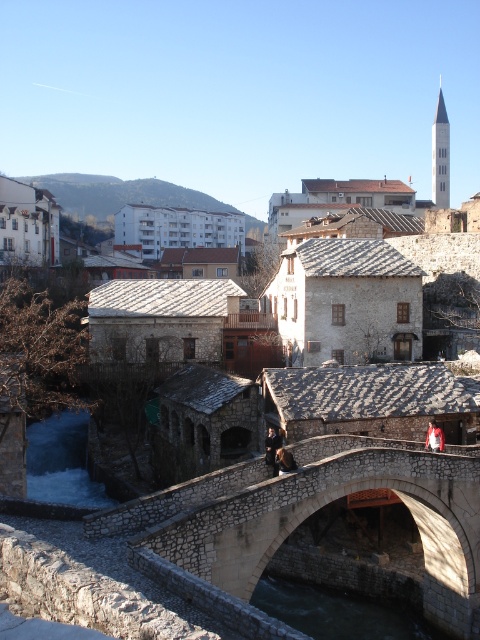
You are a tourist standing on the historic stone bridge and want to take a photo of the river below. Which part of the river, the green stone water at lower center or the white frothy water at lower left, would have a narrower width for capturing in your shot?

The green stone water at lower center has a narrower width compared to the white frothy water at lower left, so it would be better to capture the green stone water at lower center in your photo for a narrower view.

You are standing on the historic stone bridge and want to find the green stone water at lower center. Based on the coordinates provided in the Objects Description, in which direction should you look relative to your position on the bridge?

The green stone water at lower center is located at coordinates point (x=340, y=611). Since the coordinate system typically places the origin at the bottom left corner, the x value of 0.956 indicates a position far to the right, and the y value of 0.710 suggests it is near the bottom of the image. Therefore, you should look downward and to the right from your position on the bridge to locate the green stone water at lower center.

You are a photographer standing at the riverbank, wanting to capture the stone textured bridge at center in your shot. Your camera has a maximum focus range of 25 meters. Will you be able to focus on the bridge?

The stone textured bridge at center is 24.48 meters away from the camera. Since the maximum focus range is 25 meters, the bridge is within the focus range, so yes, you can focus on the bridge.